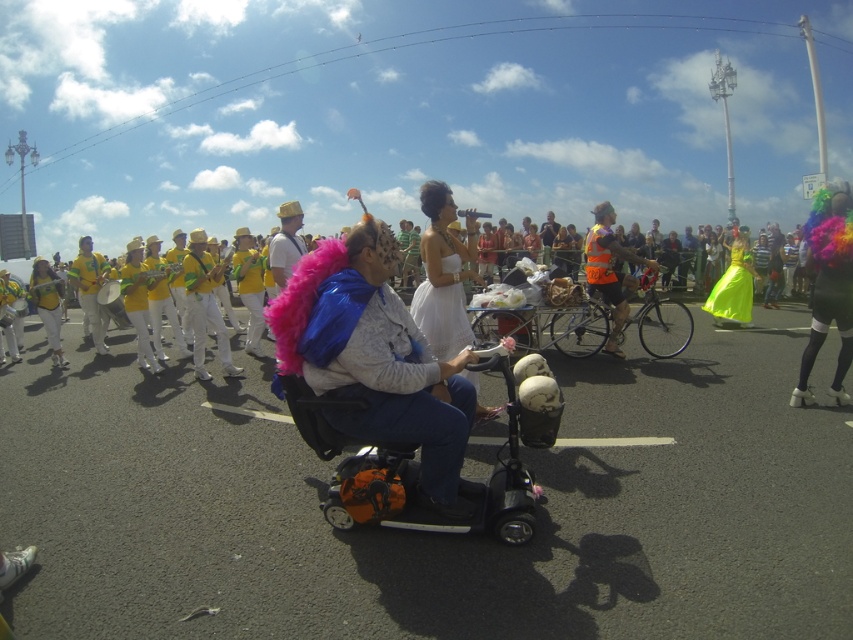
Question: Can you confirm if white satin dress at center is thinner than orange reflective vest at center?

Choices:
 (A) yes
 (B) no

Answer: (B)

Question: Estimate the real-world distances between objects in this image. Which object is closer to the white satin dress at center?

Choices:
 (A) neon yellow satin dress at right
 (B) black plastic scooter at center
 (C) orange reflective vest at center
 (D) yellow fabric hat at left

Answer: (B)

Question: Estimate the real-world distances between objects in this image. Which object is farther from the white satin dress at center?

Choices:
 (A) fuzzy pink boa at center
 (B) yellow fabric hat at left

Answer: (B)

Question: Is fuzzy pink boa at center to the right of yellow fabric hat at left from the viewer's perspective?

Choices:
 (A) no
 (B) yes

Answer: (B)

Question: Does neon multicolored wig at upper right appear over white satin dress at center?

Choices:
 (A) no
 (B) yes

Answer: (A)

Question: Which of the following is the farthest from the observer?

Choices:
 (A) black plastic scooter at center
 (B) orange reflective vest at center
 (C) neon multicolored wig at upper right
 (D) fuzzy pink boa at center

Answer: (B)